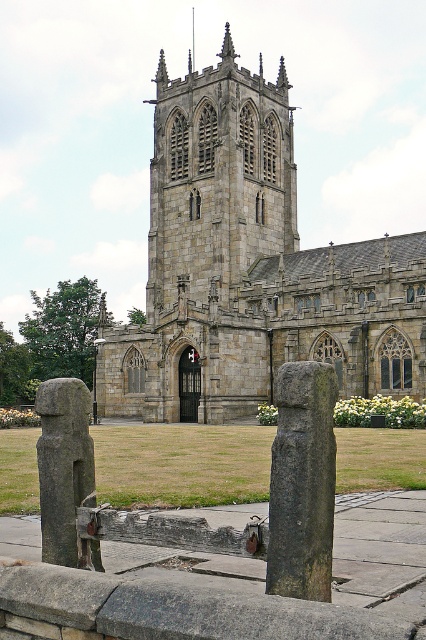
Is the position of stone gothic church at center more distant than that of gray stone post at center?

That is True.

Is stone gothic church at center smaller than gray stone post at center?

No, stone gothic church at center is not smaller than gray stone post at center.

This screenshot has width=426, height=640. Identify the location of stone gothic church at center. [x=250, y=268].

Is stone gothic church at center taller than dark gray stone pillar at center?

Yes.

Can you confirm if stone gothic church at center is wider than dark gray stone pillar at center?

Yes.

Identify the location of stone gothic church at center. (250, 268).

What do you see at coordinates (302, 483) in the screenshot?
I see `dark gray stone pillar at center` at bounding box center [302, 483].

Is point (287, 420) behind point (75, 403)?

No.

Is point (288, 541) more distant than point (92, 502)?

No, (288, 541) is closer to viewer.

Where is `dark gray stone pillar at center`? dark gray stone pillar at center is located at coordinates (302, 483).